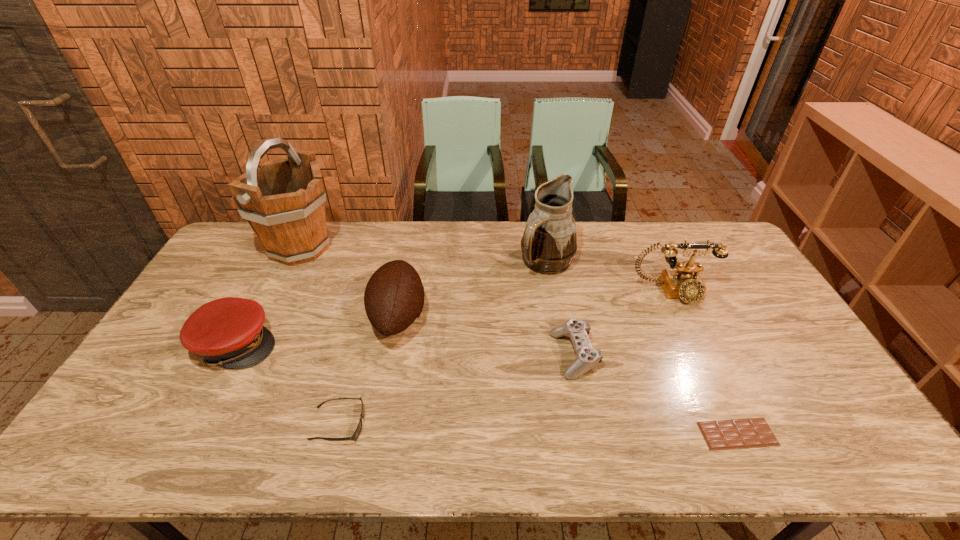
At what (x,y) coordinates should I click in order to perform the action: click on the tallest object. Please return your answer as a coordinate pair (x, y). This screenshot has width=960, height=540. Looking at the image, I should click on (283, 200).

Where is `the seventh shortest object`? Image resolution: width=960 pixels, height=540 pixels. the seventh shortest object is located at coordinates (549, 243).

At what (x,y) coordinates should I click in order to perform the action: click on telephone. Please return your answer as a coordinate pair (x, y). This screenshot has height=540, width=960. Looking at the image, I should click on (684, 282).

At what (x,y) coordinates should I click in order to perform the action: click on football. Please return your answer as a coordinate pair (x, y). Image resolution: width=960 pixels, height=540 pixels. Looking at the image, I should click on (394, 296).

Image resolution: width=960 pixels, height=540 pixels. Find the location of `the fourth shortest object`. the fourth shortest object is located at coordinates (228, 332).

At what (x,y) coordinates should I click in order to perform the action: click on control. Please return your answer as a coordinate pair (x, y). Image resolution: width=960 pixels, height=540 pixels. Looking at the image, I should click on (587, 357).

Where is `the second shortest object`? The height and width of the screenshot is (540, 960). the second shortest object is located at coordinates (354, 437).

Where is `the shortest object`? the shortest object is located at coordinates (753, 432).

At what (x,y) coordinates should I click in order to perform the action: click on free location located 0.310m on the front of the tallest object. Please return your answer as a coordinate pair (x, y). Image resolution: width=960 pixels, height=540 pixels. Looking at the image, I should click on (252, 346).

At what (x,y) coordinates should I click in order to perform the action: click on vacant space located from the spout of the second tallest object. Please return your answer as a coordinate pair (x, y). Looking at the image, I should click on (555, 305).